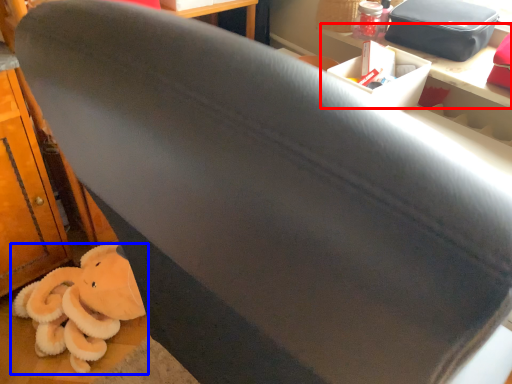
Question: Which of the following is the farthest to the observer, table (highlighted by a red box) or toy (highlighted by a blue box)?

Choices:
 (A) table
 (B) toy

Answer: (B)